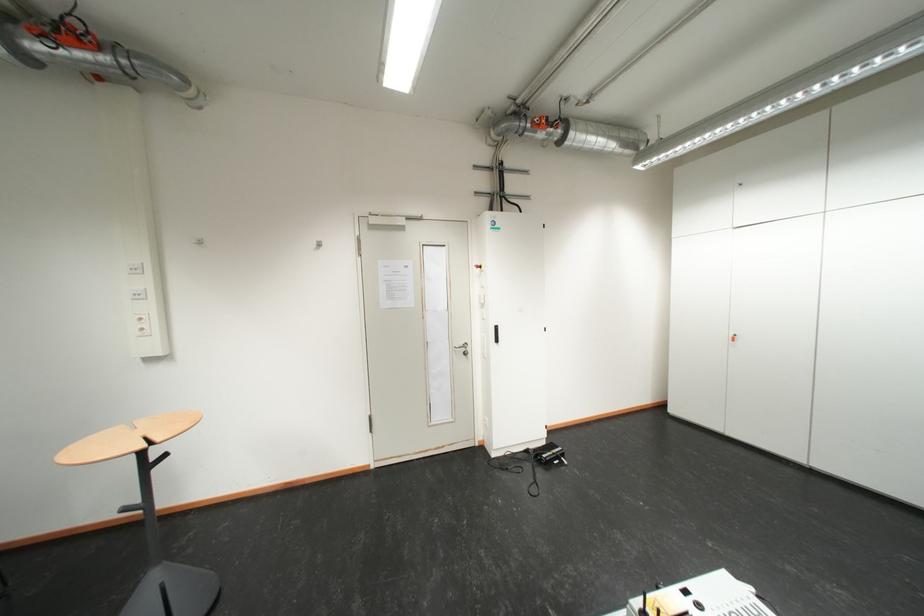
The height and width of the screenshot is (616, 924). What do you see at coordinates (733, 338) in the screenshot? I see `the red cabinet lock` at bounding box center [733, 338].